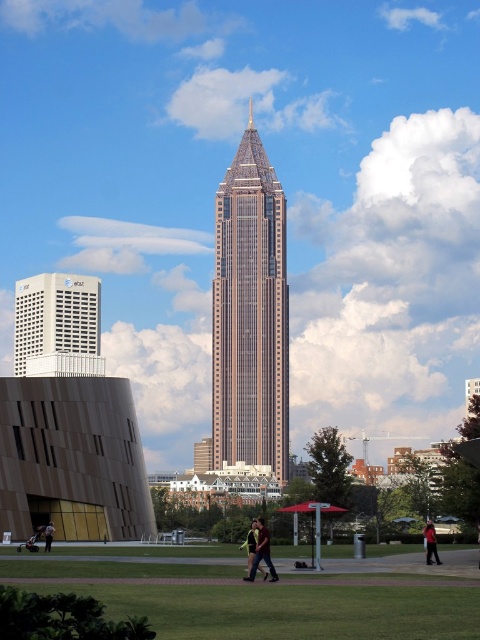
Locate an element on the screen. dark brown leather jacket at center is located at coordinates (251, 545).

Does point (250, 536) come closer to viewer compared to point (50, 536)?

That is False.

You are a GUI agent. You are given a task and a screenshot of the screen. Output one action in this format:
    pyautogui.click(x=<x>, y=<y>)
    Task: Click on the dark brown leather jacket at center
    The height and width of the screenshot is (640, 480).
    Given the screenshot: What is the action you would take?
    pyautogui.click(x=251, y=545)

Between point (19, 346) and point (431, 550), which one is positioned in front?

Positioned in front is point (431, 550).

Is point (52, 296) positioned before point (434, 561)?

Yes, it is in front of point (434, 561).

This screenshot has height=640, width=480. In order to click on white matte building at lower left in this screenshot , I will do `click(58, 324)`.

Is point (255, 541) more distant than point (428, 529)?

No.

Based on the photo, between dark brown leather jacket at center and red shirt at lower right, which one has less height?

Standing shorter between the two is red shirt at lower right.

The image size is (480, 640). What are the coordinates of `dark brown leather jacket at center` in the screenshot? It's located at (251, 545).